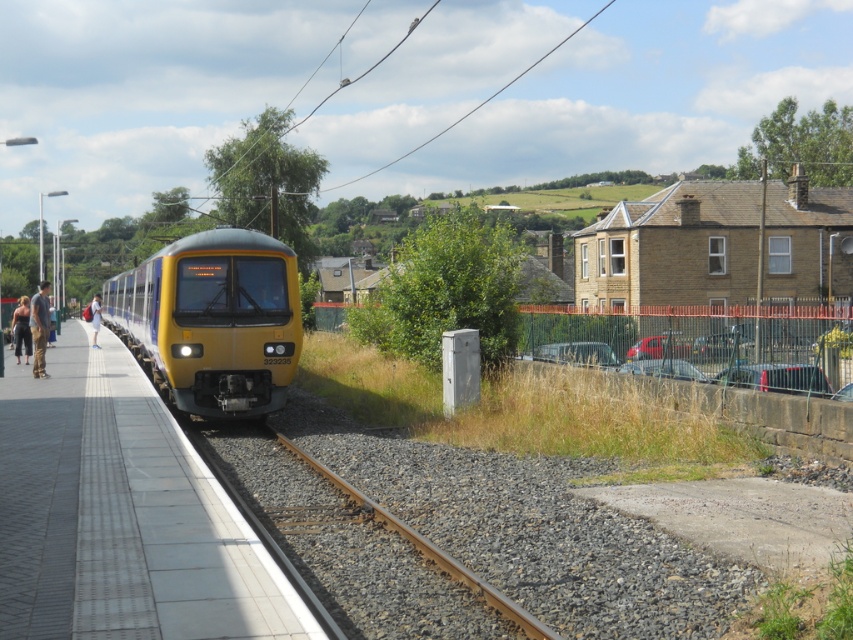
Question: Estimate the real-world distances between objects in this image. Which object is closer to the dark blue denim pants at left?

Choices:
 (A) yellow matte train at center
 (B) gravelly metallic track at center

Answer: (A)

Question: Among these objects, which one is nearest to the camera?

Choices:
 (A) yellow matte train at center
 (B) dark blue denim pants at left
 (C) smooth concrete platform at center

Answer: (C)

Question: Considering the real-world distances, which object is farthest from the smooth concrete platform at center?

Choices:
 (A) light blue denim jacket at left
 (B) yellow matte train at center
 (C) denim pants at left

Answer: (A)

Question: Can you confirm if gravelly metallic track at center is bigger than denim pants at left?

Choices:
 (A) yes
 (B) no

Answer: (B)

Question: Can you confirm if gravelly metallic track at center is smaller than denim pants at left?

Choices:
 (A) no
 (B) yes

Answer: (B)

Question: Does yellow matte train at center have a larger size compared to dark blue denim pants at left?

Choices:
 (A) yes
 (B) no

Answer: (A)